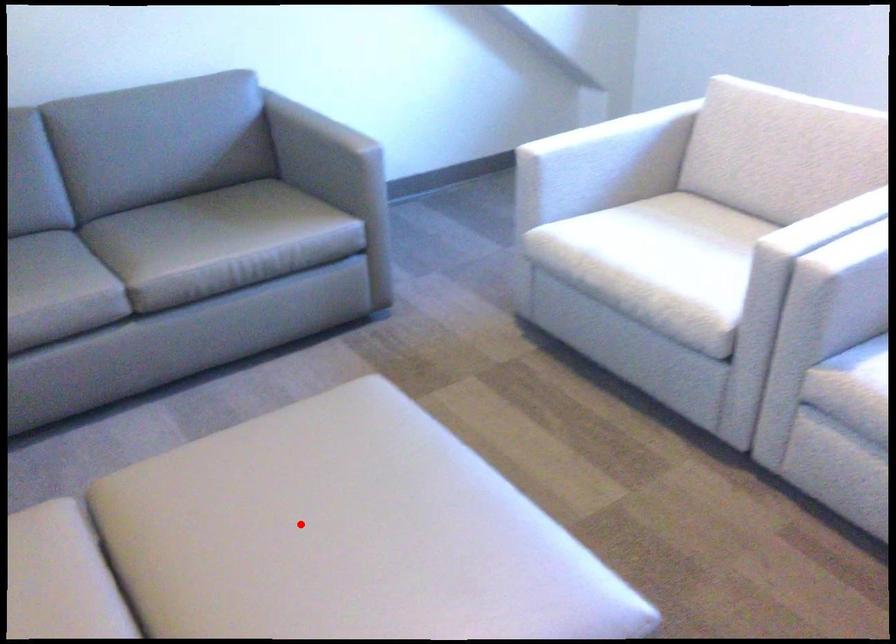
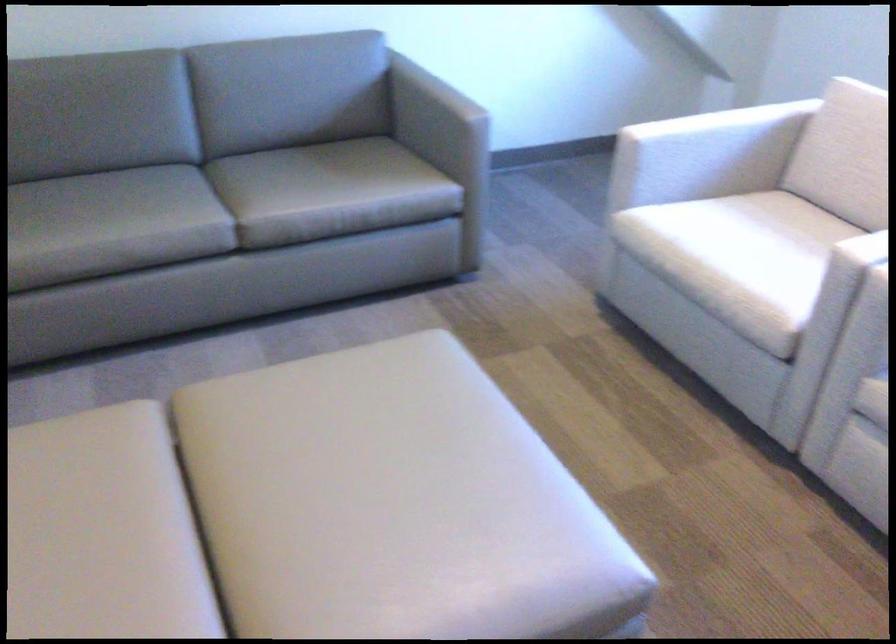
Question: I am providing you with two images of the same scene from different viewpoints. In image1, a red point is highlighted. Considering the same 3D point in image2, which of the following is correct?

Choices:
 (A) It is closer
 (B) It is farther

Answer: (B)